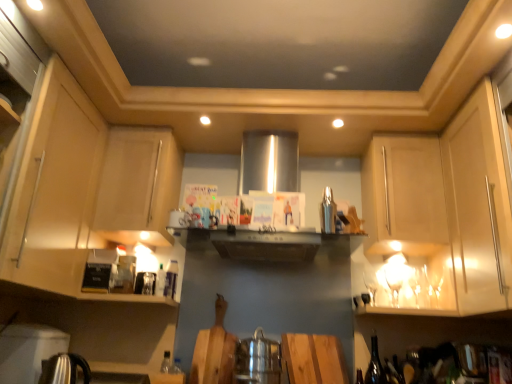
Question: Considering the positions of point (74, 357) and point (101, 213), is point (74, 357) closer or farther from the camera than point (101, 213)?

Choices:
 (A) closer
 (B) farther

Answer: (A)

Question: Relative to matte wood cabinet at upper left, positioned as the 4th cabinetry in right-to-left order, is polished stainless steel kettle at lower left, which ranks as the second appliance in right-to-left order, in front or behind?

Choices:
 (A) front
 (B) behind

Answer: (A)

Question: Which is nearer to the metallic silver kettle at lower left, positioned as the 1th appliance in left-to-right order?

Choices:
 (A) matte wood cabinet at right, which ranks as the 1th cabinetry in right-to-left order
 (B) translucent glass bottle at lower center, the 1th bottle in the left-to-right sequence
 (C) matte wood cabinet at right, placed as the third cabinetry when sorted from right to left
 (D) matte wood cabinet at right, the fourth cabinetry positioned from the left
 (E) matte wood cabinet at left, which is the 5th cabinetry from right to left

Answer: (B)

Question: Estimate the real-world distances between objects in this image. Which object is closer to the matte wood cabinet at right, the third cabinetry in the left-to-right sequence?

Choices:
 (A) matte wood cabinet at left, the 1th cabinetry when ordered from left to right
 (B) polished stainless steel kettle at lower left, which is the 3th appliance in top-to-bottom order
 (C) matte wood cabinet at right, which is the fifth cabinetry in left-to-right order
 (D) matte wood cabinet at right, the fourth cabinetry positioned from the left
 (E) satin silver shaker at upper center, acting as the 3th appliance starting from the bottom

Answer: (D)